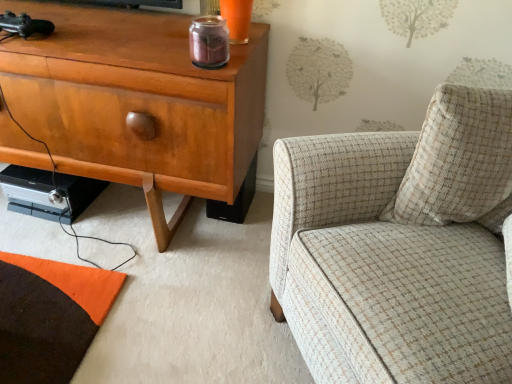
Question: From a real-world perspective, is beige textured pillow at right over plaid fabric armchair at right?

Choices:
 (A) yes
 (B) no

Answer: (A)

Question: Can you confirm if beige textured pillow at right is smaller than plaid fabric armchair at right?

Choices:
 (A) yes
 (B) no

Answer: (A)

Question: Considering the relative sizes of beige textured pillow at right and plaid fabric armchair at right in the image provided, is beige textured pillow at right bigger than plaid fabric armchair at right?

Choices:
 (A) no
 (B) yes

Answer: (A)

Question: Can you confirm if beige textured pillow at right is positioned to the right of plaid fabric armchair at right?

Choices:
 (A) no
 (B) yes

Answer: (A)

Question: From the image's perspective, does beige textured pillow at right appear higher than plaid fabric armchair at right?

Choices:
 (A) no
 (B) yes

Answer: (B)

Question: Considering the positions of point (362, 173) and point (494, 203), is point (362, 173) closer or farther from the camera than point (494, 203)?

Choices:
 (A) closer
 (B) farther

Answer: (A)

Question: Is plaid fabric armchair at right in front of or behind beige textured pillow at right in the image?

Choices:
 (A) front
 (B) behind

Answer: (A)

Question: From a real-world perspective, is plaid fabric armchair at right above or below beige textured pillow at right?

Choices:
 (A) below
 (B) above

Answer: (A)

Question: Is plaid fabric armchair at right wider or thinner than beige textured pillow at right?

Choices:
 (A) wide
 (B) thin

Answer: (A)

Question: Looking at their shapes, would you say matte wood cabinet at left is wider or thinner than beige textured pillow at right?

Choices:
 (A) thin
 (B) wide

Answer: (B)

Question: Relative to beige textured pillow at right, is matte wood cabinet at left in front or behind?

Choices:
 (A) behind
 (B) front

Answer: (A)

Question: Is matte wood cabinet at left to the left or to the right of beige textured pillow at right in the image?

Choices:
 (A) left
 (B) right

Answer: (A)

Question: From the image's perspective, is matte wood cabinet at left positioned above or below beige textured pillow at right?

Choices:
 (A) above
 (B) below

Answer: (A)

Question: Choose the correct answer: Is matte wood cabinet at left inside plaid fabric armchair at right or outside it?

Choices:
 (A) outside
 (B) inside

Answer: (A)

Question: In the image, is matte wood cabinet at left positioned in front of or behind plaid fabric armchair at right?

Choices:
 (A) front
 (B) behind

Answer: (B)